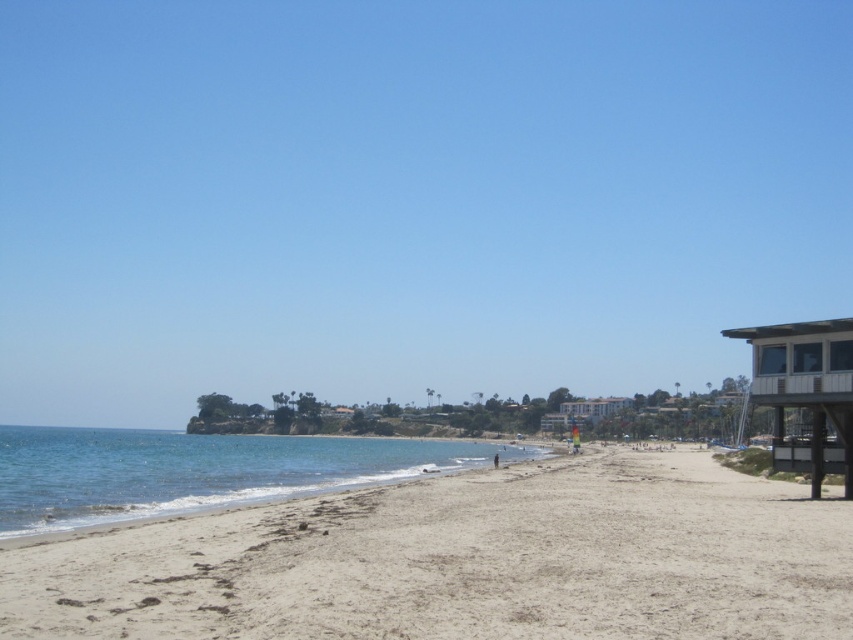
Question: Which of the following is the closest to the observer?

Choices:
 (A) (732, 611)
 (B) (27, 497)

Answer: (A)

Question: Which of the following is the closest to the observer?

Choices:
 (A) light beige sand at lower center
 (B) clear blue water at lower left

Answer: (A)

Question: Among these objects, which one is nearest to the camera?

Choices:
 (A) clear blue water at lower left
 (B) light beige sand at lower center

Answer: (B)

Question: Is light beige sand at lower center below clear blue water at lower left?

Choices:
 (A) no
 (B) yes

Answer: (A)

Question: Is light beige sand at lower center to the right of clear blue water at lower left from the viewer's perspective?

Choices:
 (A) yes
 (B) no

Answer: (A)

Question: Can you confirm if light beige sand at lower center is bigger than clear blue water at lower left?

Choices:
 (A) no
 (B) yes

Answer: (A)